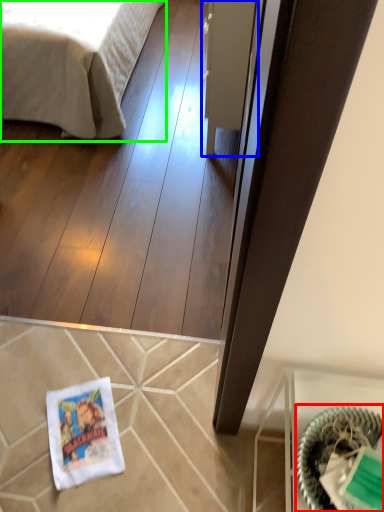
Question: Estimate the real-world distances between objects in this image. Which object is farther from basket (highlighted by a red box), glass door (highlighted by a blue box) or bed (highlighted by a green box)?

Choices:
 (A) glass door
 (B) bed

Answer: (B)